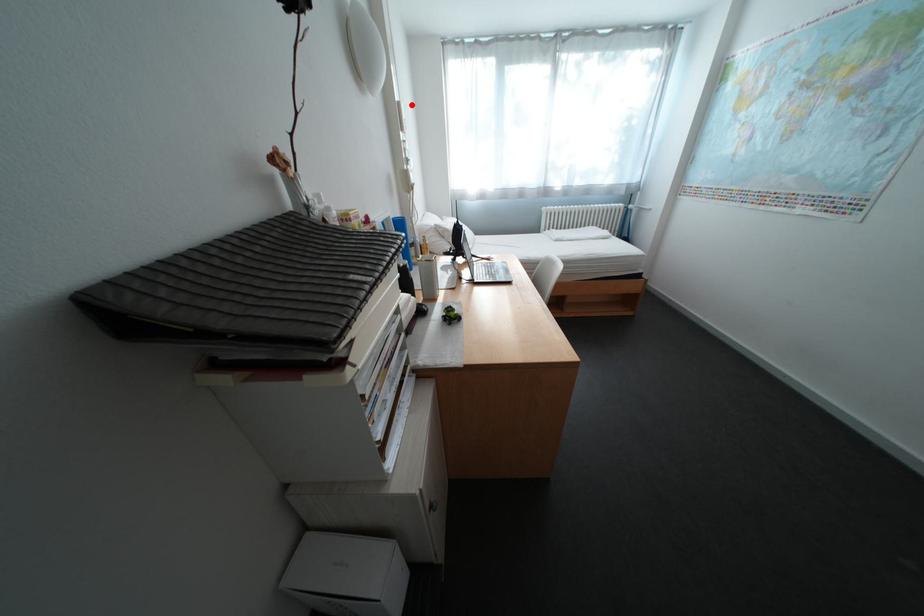
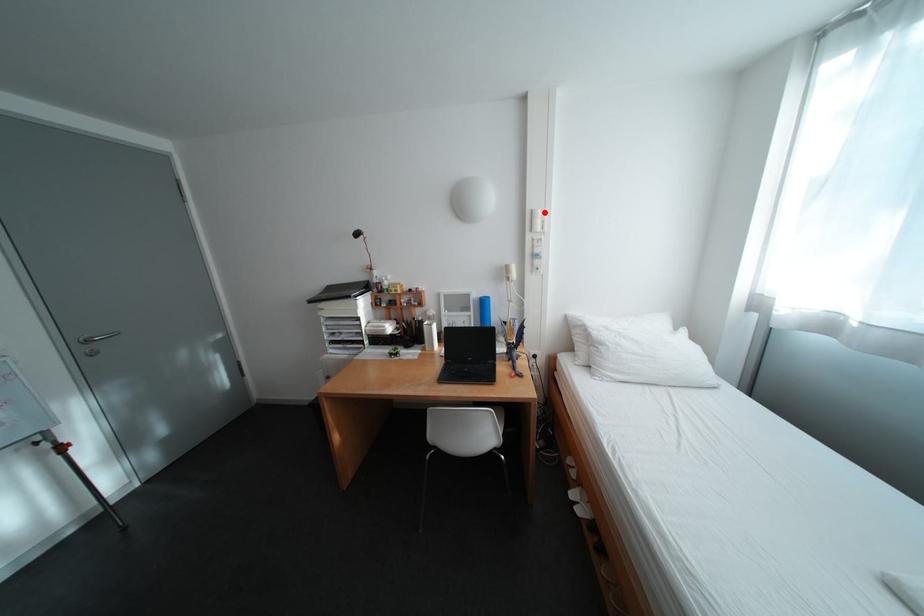
I am providing you with two images of the same scene from different viewpoints. A red point is marked on the first image and another point is marked on the second image. Is the marked point in image1 the same physical position as the marked point in image2?

Yes